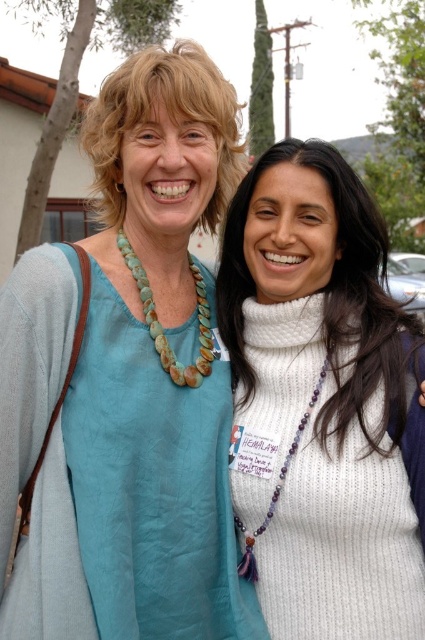
Who is taller, matte blue blouse at center or purple beaded necklace at center?

matte blue blouse at center

Is point (11, 458) closer to camera compared to point (240, 522)?

Yes.

Where is `matte blue blouse at center`? matte blue blouse at center is located at coordinates 127,381.

Is green stone necklace at center wider than purple beaded necklace at center?

Yes, green stone necklace at center is wider than purple beaded necklace at center.

Which is behind, point (201, 284) or point (291, 460)?

Positioned behind is point (201, 284).

You are a GUI agent. You are given a task and a screenshot of the screen. Output one action in this format:
    pyautogui.click(x=<x>, y=<y>)
    Task: Click on the green stone necklace at center
    
    Given the screenshot: What is the action you would take?
    pyautogui.click(x=161, y=326)

Is white knitted sweater at center bigger than purple beaded necklace at center?

Indeed, white knitted sweater at center has a larger size compared to purple beaded necklace at center.

Does white knitted sweater at center have a lesser height compared to purple beaded necklace at center?

No, white knitted sweater at center is not shorter than purple beaded necklace at center.

Where is `white knitted sweater at center`? white knitted sweater at center is located at coordinates (323, 400).